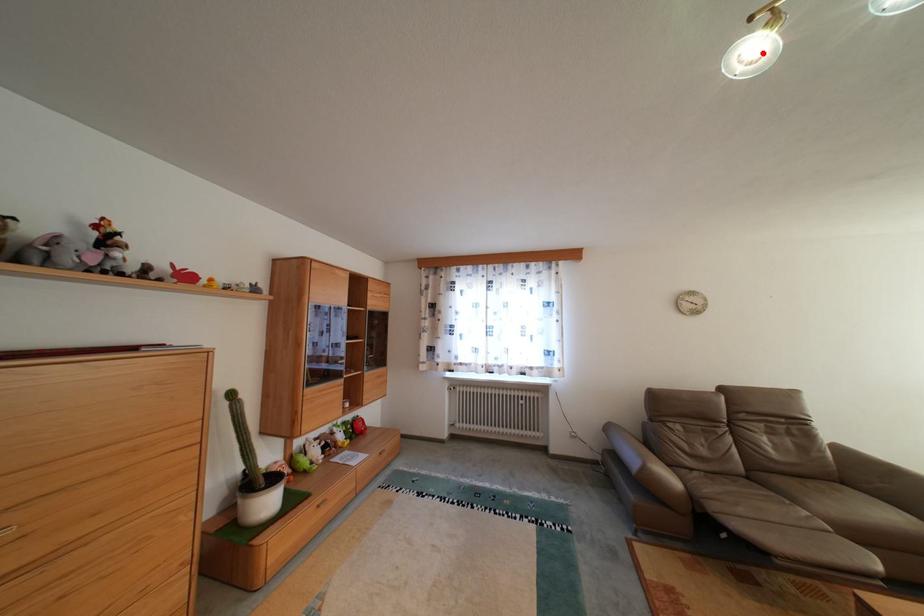
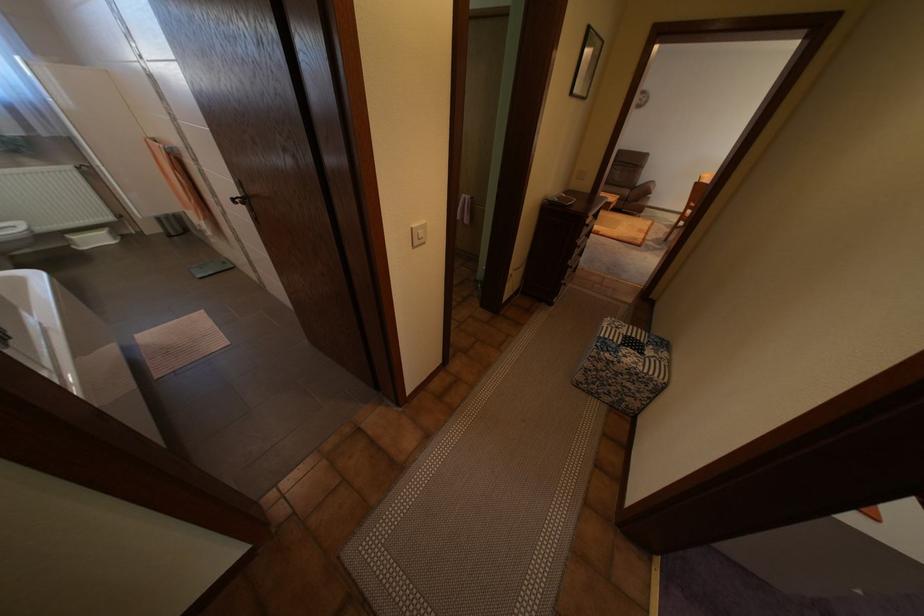
Question: I am providing you with two images of the same scene from different viewpoints. A red point is marked on the first image. Is the red point's position out of view in image 2?

Choices:
 (A) Yes
 (B) No

Answer: (A)